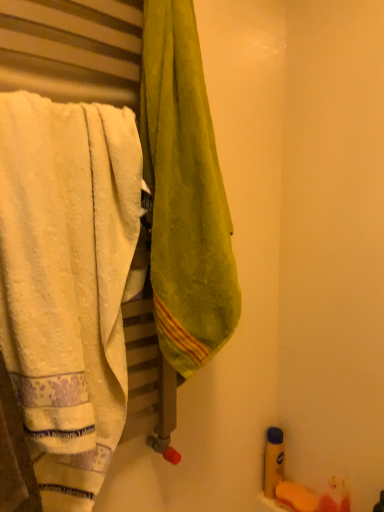
Question: Is point (185, 72) positioned closer to the camera than point (77, 280)?

Choices:
 (A) closer
 (B) farther

Answer: (B)

Question: Considering their positions, is green velvety towel at center, the second towel positioned from the left, located in front of or behind white soft towel at left, arranged as the first towel when viewed from the left?

Choices:
 (A) front
 (B) behind

Answer: (B)

Question: Which object is positioned farthest from the green velvety towel at center, positioned as the first towel in right-to-left order?

Choices:
 (A) white soft towel at left, acting as the 2th towel starting from the right
 (B) yellow matte bottle at lower right

Answer: (B)

Question: Which object is positioned farthest from the white soft towel at left, arranged as the first towel when viewed from the left?

Choices:
 (A) yellow matte bottle at lower right
 (B) green velvety towel at center, positioned as the first towel in right-to-left order

Answer: (A)